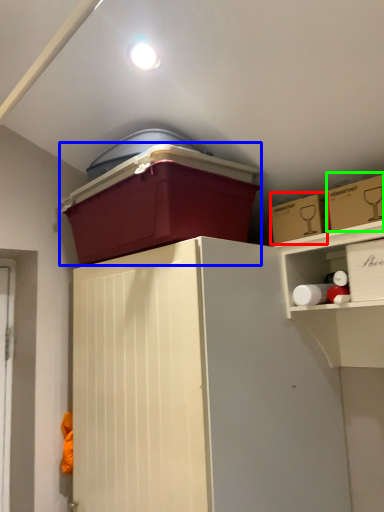
Question: Which object is the farthest from storage box (highlighted by a red box)? Choose among these: storage box (highlighted by a blue box) or storage box (highlighted by a green box).

Choices:
 (A) storage box
 (B) storage box

Answer: (A)